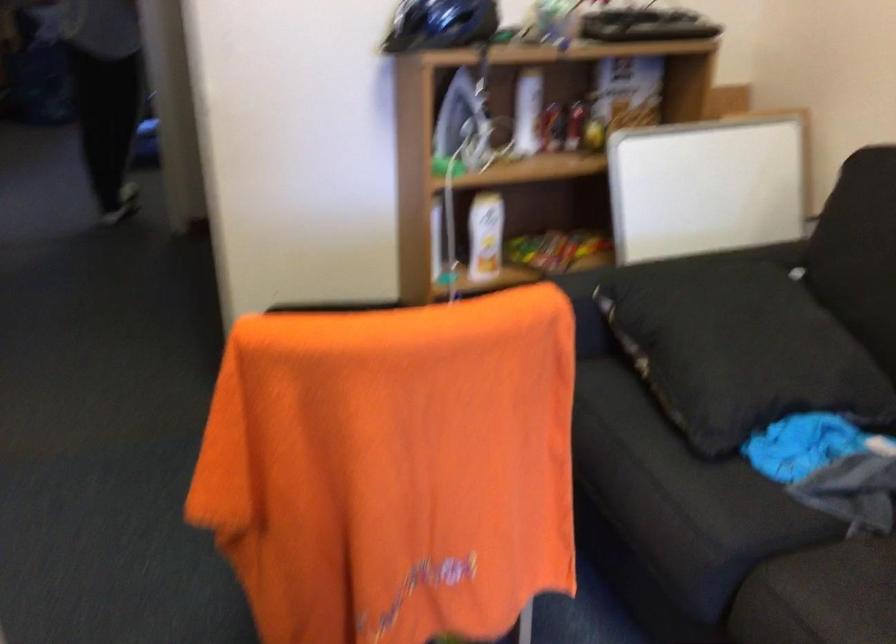
First-person continuous shooting, in which direction is the camera rotating?

The camera's rotation is toward right-down.